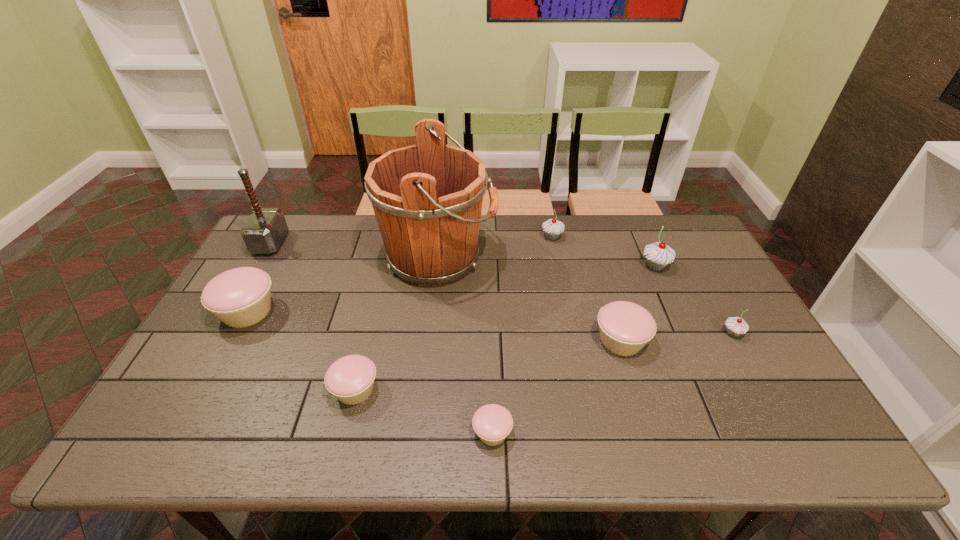
Locate an element on the screen. the rightmost pink cupcake is located at coordinates (625, 328).

Where is `the rightmost cupcake`? This screenshot has height=540, width=960. the rightmost cupcake is located at coordinates (736, 326).

This screenshot has height=540, width=960. What are the coordinates of `the rightmost object` in the screenshot? It's located at (736, 326).

I want to click on the eighth tallest object, so click(x=350, y=379).

Where is `the second shortest cupcake`? Image resolution: width=960 pixels, height=540 pixels. the second shortest cupcake is located at coordinates (350, 379).

Find the location of a particular element. Image resolution: width=960 pixels, height=540 pixels. the second pink cupcake from right to left is located at coordinates (492, 423).

At what (x,y) coordinates should I click in order to perform the action: click on the nearest cupcake. Please return your answer as a coordinate pair (x, y). This screenshot has width=960, height=540. Looking at the image, I should click on (492, 423).

Identify the location of free space located with the handle on the side of the tallest object. The width and height of the screenshot is (960, 540). (594, 258).

Where is `vacant area situated on the right of the second tallest object`? The height and width of the screenshot is (540, 960). vacant area situated on the right of the second tallest object is located at coordinates [x=364, y=243].

The image size is (960, 540). What are the coordinates of `vacant space situated on the back of the second object from right to left` in the screenshot? It's located at tap(645, 244).